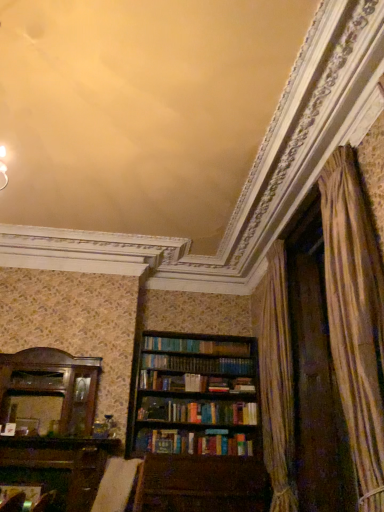
What do you see at coordinates (194, 396) in the screenshot?
I see `wooden bookcase at center` at bounding box center [194, 396].

Find the location of a particular element. wooden bookcase at center is located at coordinates tap(194, 396).

Measure the distance between wooden bookcase at center and camera.

The distance of wooden bookcase at center from camera is 3.97 meters.

You are a GUI agent. You are given a task and a screenshot of the screen. Output one action in this format:
    pyautogui.click(x=<x>, y=<y>)
    Task: Click on the wooden bookcase at center
    
    Given the screenshot: What is the action you would take?
    pyautogui.click(x=194, y=396)